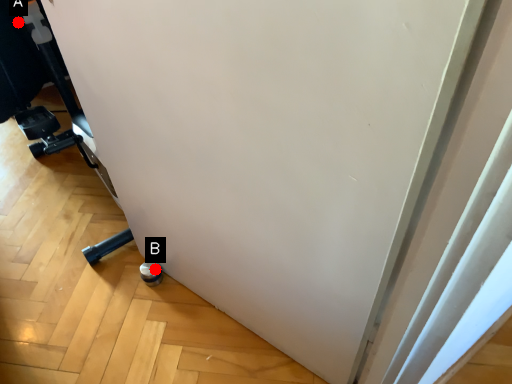
Question: Two points are circled on the image, labeled by A and B beside each circle. Among these points, which one is farthest from the camera?

Choices:
 (A) A is further
 (B) B is further

Answer: (A)